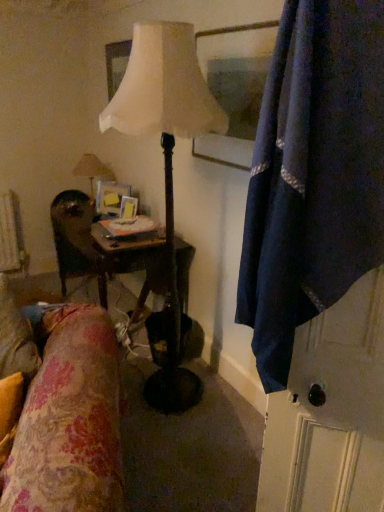
Question: Is wooden glossy picture frame at center shorter than matte white lamp at center, acting as the second lamp starting from the back?

Choices:
 (A) yes
 (B) no

Answer: (A)

Question: From the image's perspective, would you say wooden glossy picture frame at center is positioned over matte white lamp at center, arranged as the first lamp when viewed from the front?

Choices:
 (A) yes
 (B) no

Answer: (A)

Question: Would you say matte white lamp at center, arranged as the first lamp when viewed from the front, is part of wooden glossy picture frame at center's contents?

Choices:
 (A) no
 (B) yes

Answer: (A)

Question: Can you see wooden glossy picture frame at center touching matte white lamp at center, acting as the second lamp starting from the back?

Choices:
 (A) yes
 (B) no

Answer: (B)

Question: Considering the relative positions of wooden glossy picture frame at center and matte white lamp at center, marked as the 1th lamp in a right-to-left arrangement, in the image provided, is wooden glossy picture frame at center to the left of matte white lamp at center, marked as the 1th lamp in a right-to-left arrangement, from the viewer's perspective?

Choices:
 (A) yes
 (B) no

Answer: (A)

Question: From the image's perspective, is matte white lamp at center, marked as the 1th lamp in a right-to-left arrangement, located above or below navy blue fabric at right?

Choices:
 (A) above
 (B) below

Answer: (A)

Question: Visually, is matte white lamp at center, marked as the 1th lamp in a right-to-left arrangement, positioned to the left or to the right of navy blue fabric at right?

Choices:
 (A) left
 (B) right

Answer: (A)

Question: Considering the positions of matte white lamp at center, acting as the second lamp starting from the back, and navy blue fabric at right in the image, is matte white lamp at center, acting as the second lamp starting from the back, taller or shorter than navy blue fabric at right?

Choices:
 (A) tall
 (B) short

Answer: (A)

Question: Would you say matte white lamp at center, positioned as the 2th lamp in left-to-right order, is inside or outside navy blue fabric at right?

Choices:
 (A) inside
 (B) outside

Answer: (B)

Question: Considering the positions of navy blue fabric at right and matte beige lamp at upper left, placed as the second lamp when sorted from front to back, in the image, is navy blue fabric at right bigger or smaller than matte beige lamp at upper left, placed as the second lamp when sorted from front to back,?

Choices:
 (A) small
 (B) big

Answer: (B)

Question: From the image's perspective, is navy blue fabric at right located above or below matte beige lamp at upper left, placed as the second lamp when sorted from front to back?

Choices:
 (A) above
 (B) below

Answer: (B)

Question: Is navy blue fabric at right inside or outside of matte beige lamp at upper left, placed as the second lamp when sorted from front to back?

Choices:
 (A) inside
 (B) outside

Answer: (B)

Question: From a real-world perspective, is navy blue fabric at right physically located above or below matte beige lamp at upper left, placed as the second lamp when sorted from right to left?

Choices:
 (A) below
 (B) above

Answer: (B)

Question: Is point (198, 119) closer or farther from the camera than point (92, 456)?

Choices:
 (A) farther
 (B) closer

Answer: (A)

Question: From the image's perspective, is matte white lamp at center, marked as the 1th lamp in a right-to-left arrangement, above or below floral fabric at lower left?

Choices:
 (A) above
 (B) below

Answer: (A)